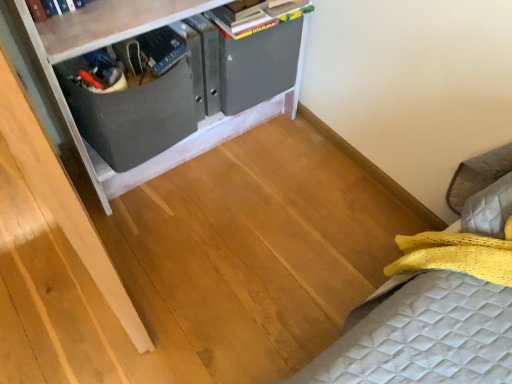
Question: Is matte gray cabinet at upper left wider than matte black drawer at center?

Choices:
 (A) no
 (B) yes

Answer: (B)

Question: Does matte gray cabinet at upper left appear on the right side of matte black drawer at center?

Choices:
 (A) no
 (B) yes

Answer: (B)

Question: From the image's perspective, would you say matte gray cabinet at upper left is shown under matte black drawer at center?

Choices:
 (A) yes
 (B) no

Answer: (B)

Question: Is matte gray cabinet at upper left shorter than matte black drawer at center?

Choices:
 (A) no
 (B) yes

Answer: (A)

Question: Is matte gray cabinet at upper left to the left of matte black drawer at center from the viewer's perspective?

Choices:
 (A) yes
 (B) no

Answer: (B)

Question: Is hardcover book at upper center inside or outside of matte gray cabinet at upper left?

Choices:
 (A) outside
 (B) inside

Answer: (B)

Question: Considering their positions, is hardcover book at upper center located in front of or behind matte gray cabinet at upper left?

Choices:
 (A) front
 (B) behind

Answer: (B)

Question: From a real-world perspective, is hardcover book at upper center physically located above or below matte gray cabinet at upper left?

Choices:
 (A) below
 (B) above

Answer: (B)

Question: Looking at their shapes, would you say hardcover book at upper center is wider or thinner than matte gray cabinet at upper left?

Choices:
 (A) wide
 (B) thin

Answer: (B)

Question: Would you say matte gray cabinet at upper left is to the left or to the right of hardcover book at upper center in the picture?

Choices:
 (A) right
 (B) left

Answer: (B)

Question: From a real-world perspective, relative to hardcover book at upper center, is matte gray cabinet at upper left vertically above or below?

Choices:
 (A) above
 (B) below

Answer: (B)

Question: From their relative heights in the image, would you say matte gray cabinet at upper left is taller or shorter than hardcover book at upper center?

Choices:
 (A) short
 (B) tall

Answer: (B)

Question: From the image's perspective, is matte gray cabinet at upper left located above or below hardcover book at upper center?

Choices:
 (A) below
 (B) above

Answer: (A)

Question: Relative to matte black drawer at center, is hardcover book at upper center in front or behind?

Choices:
 (A) behind
 (B) front

Answer: (A)

Question: From the image's perspective, is hardcover book at upper center above or below matte black drawer at center?

Choices:
 (A) above
 (B) below

Answer: (A)